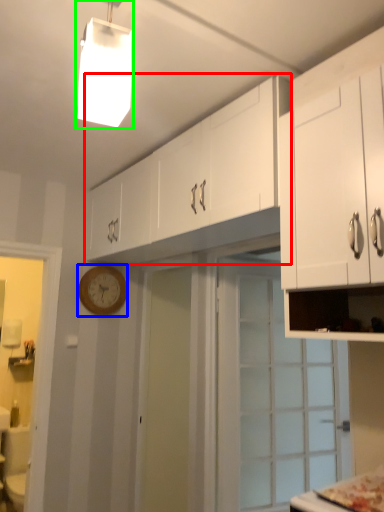
Question: Which object is the farthest from cabinetry (highlighted by a red box)? Choose among these: clock (highlighted by a blue box) or light fixture (highlighted by a green box).

Choices:
 (A) clock
 (B) light fixture

Answer: (B)